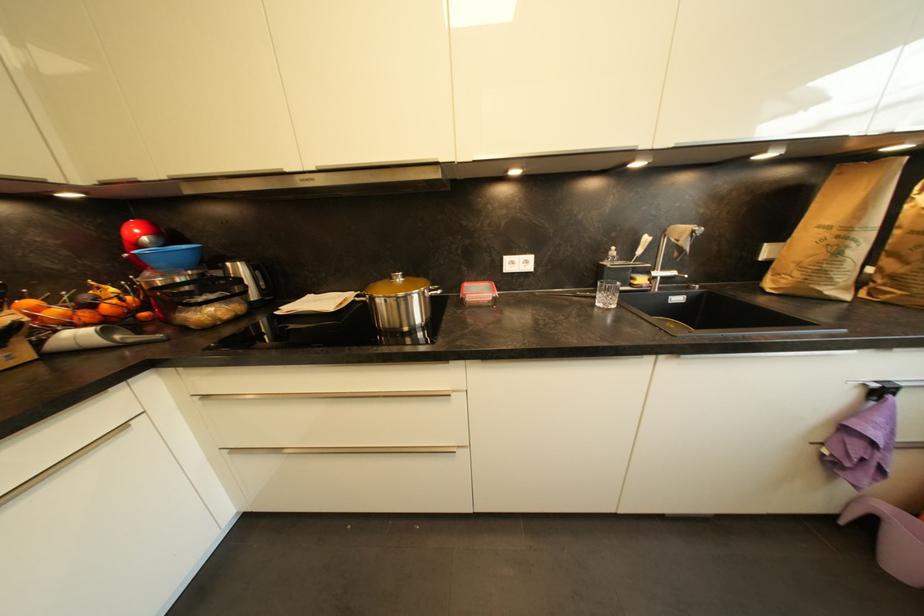
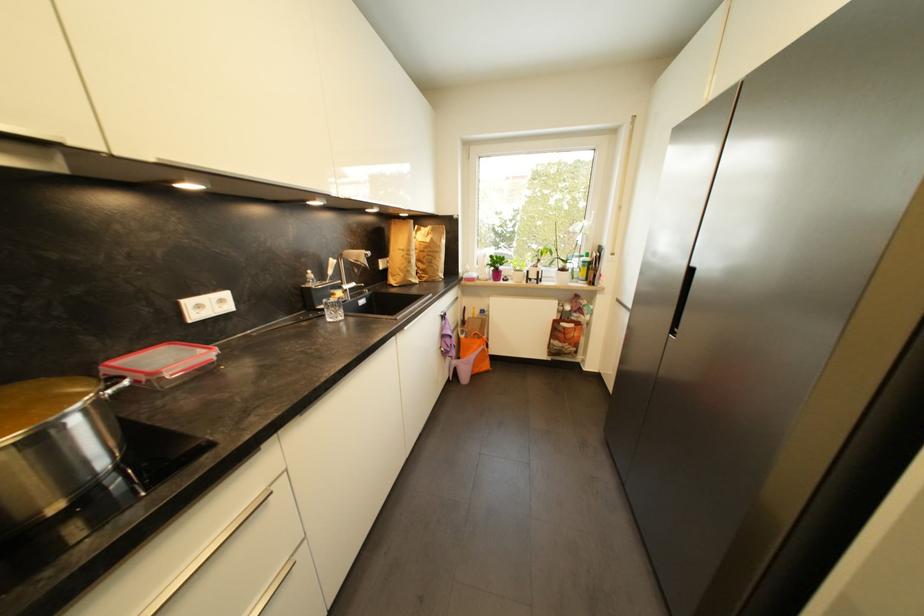
In the second image, find the point that corresponds to [610,302] in the first image.

(339, 317)